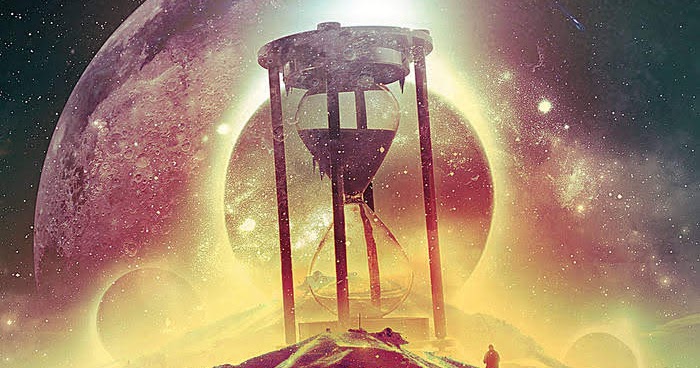
You are a GUI agent. You are given a task and a screenshot of the screen. Output one action in this format:
    pyautogui.click(x=<x>, y=<y>)
    Task: Click on the sand in hourglass
    
    Given the screenshot: What is the action you would take?
    pyautogui.click(x=357, y=147)